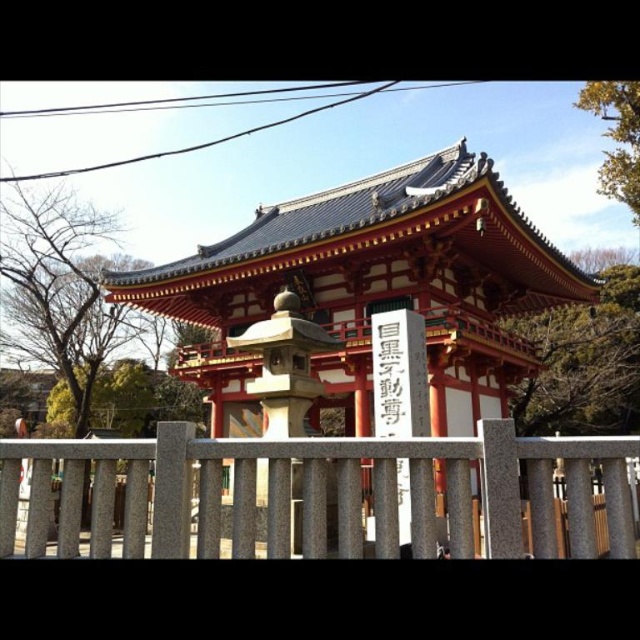
You are standing in front of the traditional Japanese temple gate and notice two points marked on the structure. Which of the two points, point (390, 484) or point (378, 406), is closer to your current position?

Point (390, 484) is closer to the camera than point (378, 406).

You are a visitor at the shrine and want to find the entrance. You see the gray stone fence at center and the black stone sign at center. Which one should you walk around to find the path leading to the shrine?

You should walk around the gray stone fence at center because it is positioned on the left side of the black stone sign at center, indicating the path might be to the right of the sign.